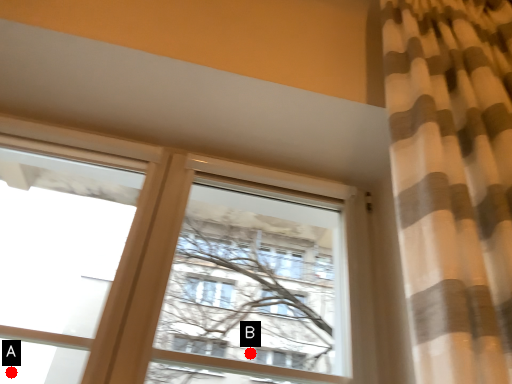
Question: Two points are circled on the image, labeled by A and B beside each circle. Which point is closer to the camera?

Choices:
 (A) A is closer
 (B) B is closer

Answer: (A)